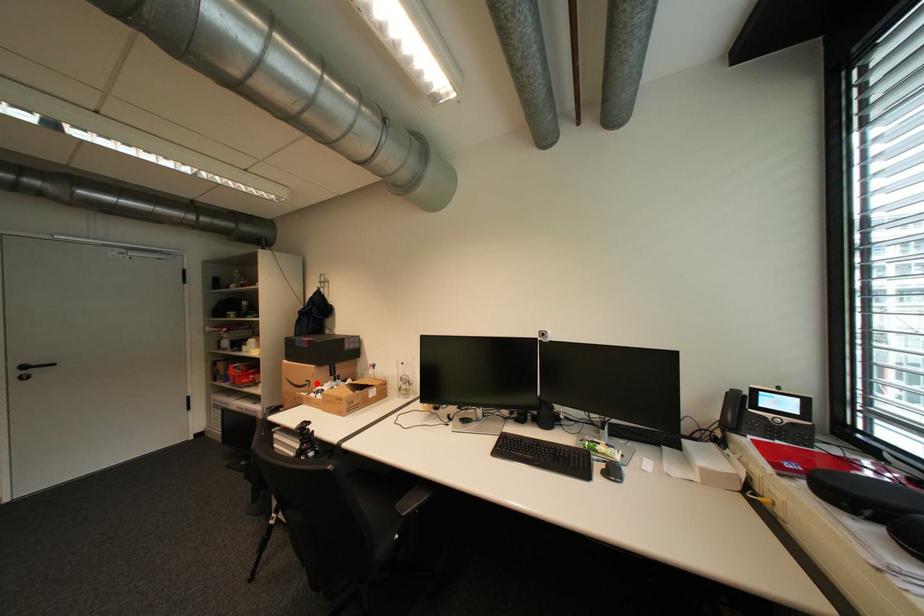
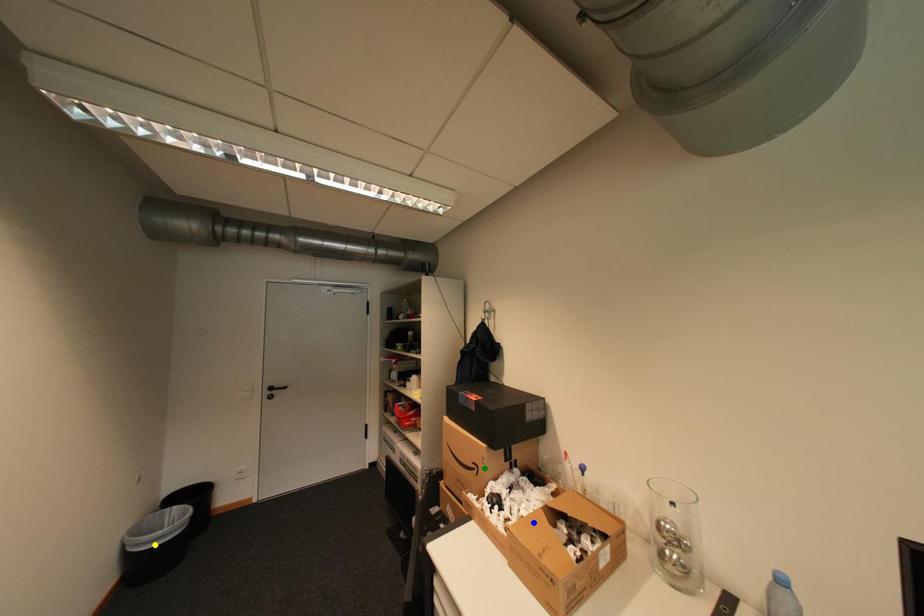
Question: I am providing you with two images of the same scene from different viewpoints. A red point is marked on the first image. You are given multiple points on the second image. In image 2, which mark is for the same physical point as the one in image 1?

Choices:
 (A) green point
 (B) blue point
 (C) yellow point

Answer: (A)